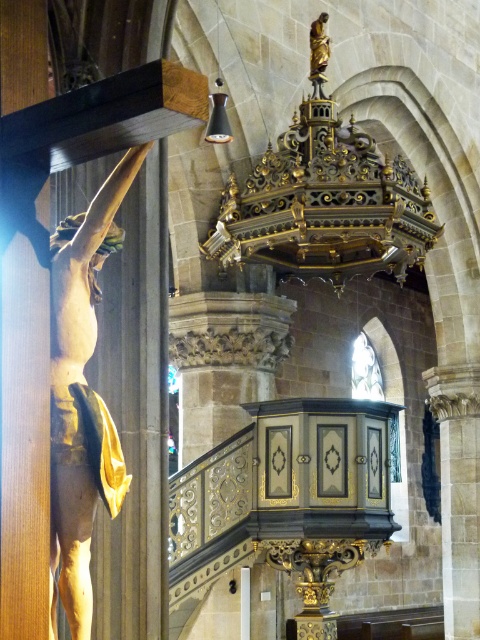
Question: Observing the image, what is the correct spatial positioning of matte gold statue at left in reference to gold polished wood statue at upper center?

Choices:
 (A) right
 (B) left

Answer: (B)

Question: Can you confirm if matte gold statue at left is positioned below gold polished wood statue at upper center?

Choices:
 (A) yes
 (B) no

Answer: (A)

Question: Which point is farther from the camera taking this photo?

Choices:
 (A) (313, 20)
 (B) (62, 353)

Answer: (A)

Question: Which of the following is the closest to the observer?

Choices:
 (A) (319, 33)
 (B) (64, 396)

Answer: (B)

Question: Does matte gold statue at left have a greater width compared to gold polished wood statue at upper center?

Choices:
 (A) yes
 (B) no

Answer: (A)

Question: Which of the following is the farthest from the observer?

Choices:
 (A) matte gold statue at left
 (B) gold polished wood statue at upper center

Answer: (B)